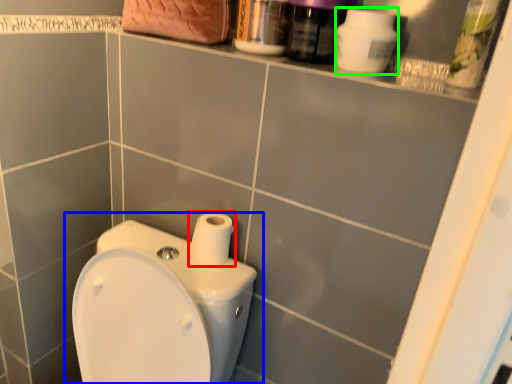
Question: Which is nearer to the toilet paper (highlighted by a red box)? toilet (highlighted by a blue box) or cleaning product (highlighted by a green box).

Choices:
 (A) toilet
 (B) cleaning product

Answer: (A)